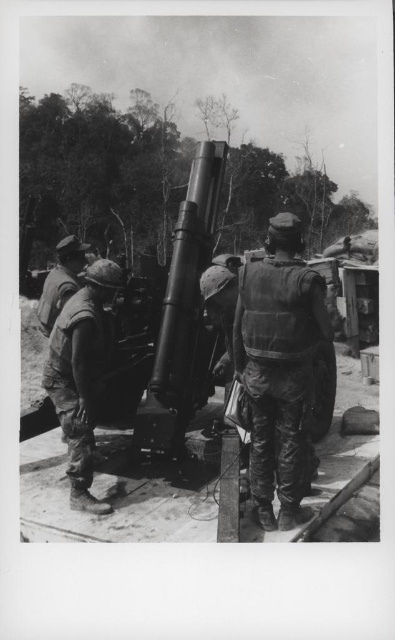
Does camouflage fabric vest at center lie behind camouflage fabric helmet at center?

No, camouflage fabric vest at center is in front of camouflage fabric helmet at center.

Is camouflage fabric vest at center in front of camouflage fabric helmet at center?

Yes.

I want to click on camouflage fabric vest at center, so click(x=280, y=369).

The height and width of the screenshot is (640, 395). I want to click on camouflage fabric vest at center, so click(280, 369).

Does camouflage fabric vest at center have a greater width compared to camouflage fabric uniform at center?

No, camouflage fabric vest at center is not wider than camouflage fabric uniform at center.

Between point (272, 236) and point (88, 374), which one is positioned behind?

The point (88, 374) is more distant.

Locate an element on the screen. Image resolution: width=395 pixels, height=640 pixels. camouflage fabric vest at center is located at coordinates (280, 369).

Who is positioned more to the right, camouflage fabric uniform at center or camouflage fabric helmet at center?

camouflage fabric uniform at center is more to the right.

Who is more distant from viewer, [69,388] or [67,262]?

The point [67,262] is more distant.

Where is `camouflage fabric uniform at center`? camouflage fabric uniform at center is located at coordinates (82, 374).